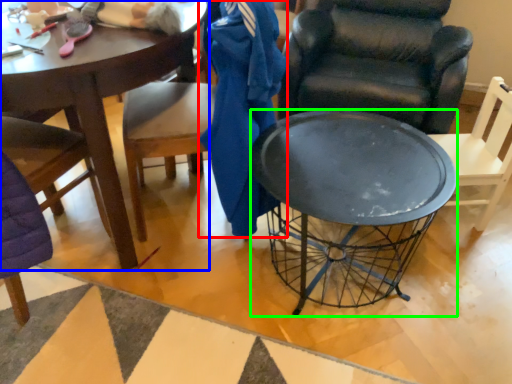
Question: Which object is the closest to the clothing (highlighted by a red box)? Choose among these: coffee table (highlighted by a blue box) or desk (highlighted by a green box).

Choices:
 (A) coffee table
 (B) desk

Answer: (B)